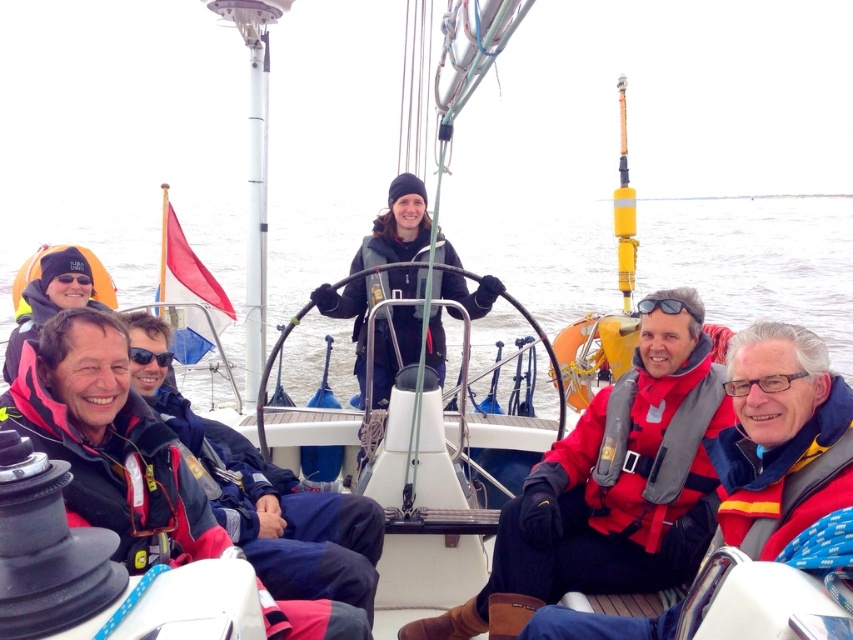
You are a sailor on the boat and need to quickly grab a life vest. Which one is closer to your right side, the red life vest at lower right or the red matte life jacket at lower right?

The red life vest at lower right is to the right of the red matte life jacket at lower right, so the red life vest at lower right is closer to your right side.

You are a sailor on the boat and need to retrieve an item from the water. The item is floating at the position where the clear water at center and red life vest at lower right are. Which direction should you lean to reach it?

The clear water at center is much taller than the red life vest at lower right, so the item is floating closer to the red life vest at lower right. Lean towards the red life vest at lower right to reach it.

You are a sailor on the boat and need to retrieve an item from the deck. You see the clear water at center and the red life vest at lower right. Which object is higher in position?

The clear water at center is above the red life vest at lower right, so the clear water at center is higher in position.